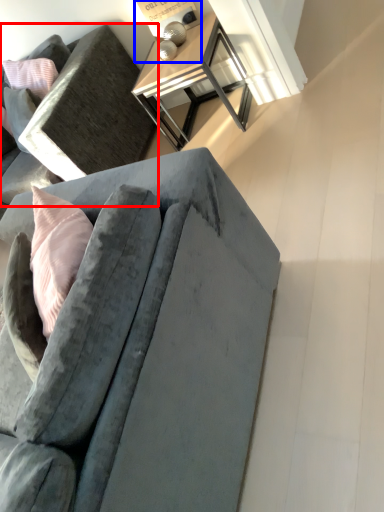
Question: Which object is further to the camera taking this photo, studio couch (highlighted by a red box) or table lamp (highlighted by a blue box)?

Choices:
 (A) studio couch
 (B) table lamp

Answer: (B)